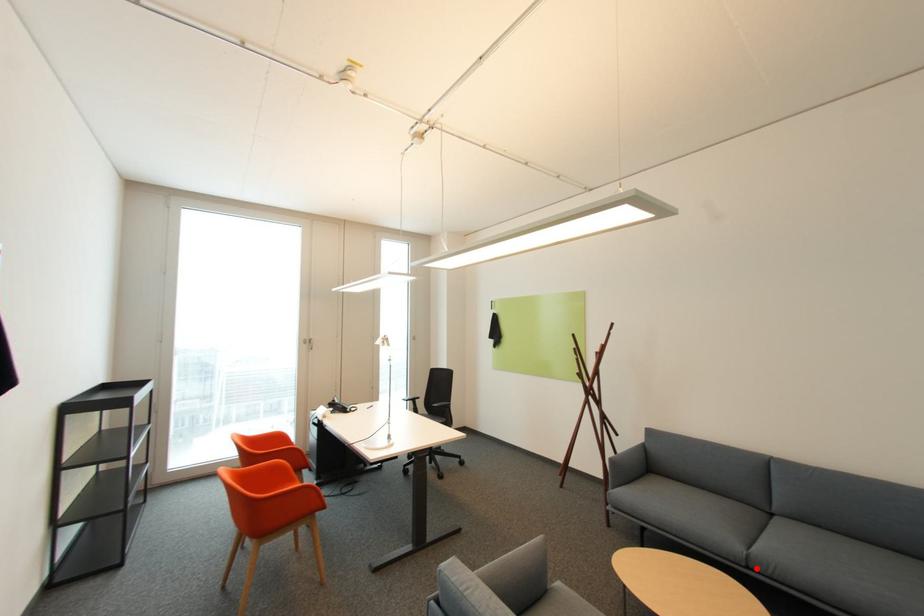
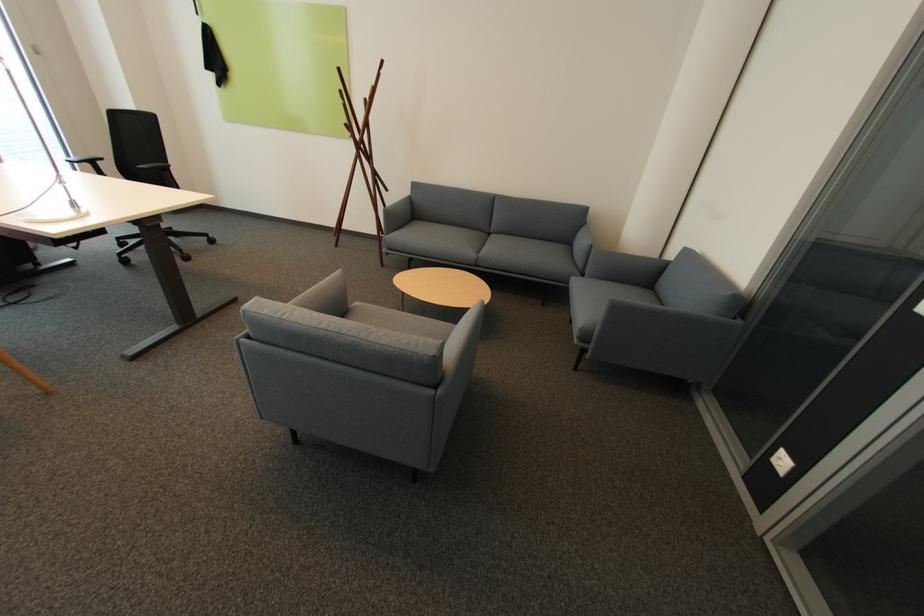
Question: I am providing you with two images of the same scene from different viewpoints. Given a red point in image1, look at the same physical point in image2. Is it:

Choices:
 (A) Closer to the viewpoint
 (B) Farther from the viewpoint

Answer: (A)